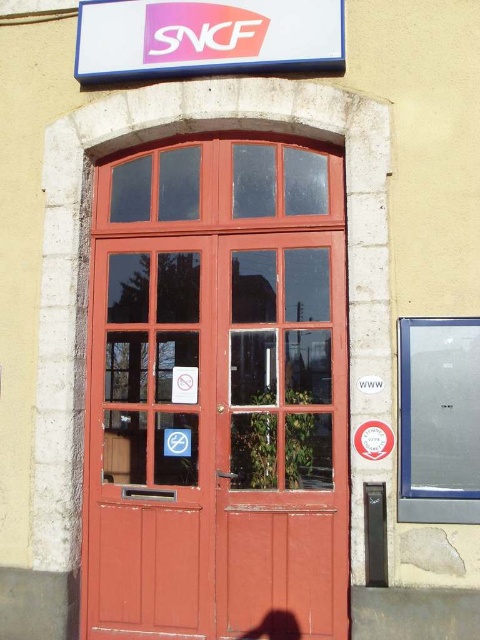
Question: Is smooth wood door at center to the left of pink plastic sign at upper center from the viewer's perspective?

Choices:
 (A) yes
 (B) no

Answer: (B)

Question: Can you confirm if smooth wood door at center is bigger than pink plastic sign at upper center?

Choices:
 (A) no
 (B) yes

Answer: (B)

Question: Can you confirm if smooth wood door at center is positioned to the right of pink plastic sign at upper center?

Choices:
 (A) yes
 (B) no

Answer: (A)

Question: Which of the following is the farthest from the observer?

Choices:
 (A) (225, 51)
 (B) (336, 234)

Answer: (B)